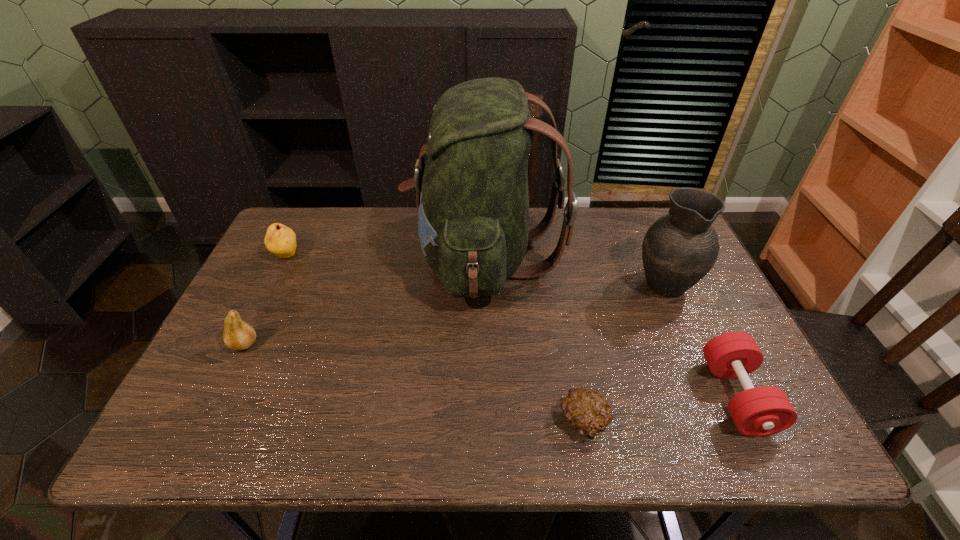
Image resolution: width=960 pixels, height=540 pixels. What are the coordinates of `pitcher present at the right edge` in the screenshot? It's located at (679, 249).

Where is `dumbbell that is at the right edge`? This screenshot has width=960, height=540. dumbbell that is at the right edge is located at coordinates (761, 411).

I want to click on object that is at the far left corner, so click(x=281, y=240).

You are a GUI agent. You are given a task and a screenshot of the screen. Output one action in this format:
    pyautogui.click(x=<x>, y=<y>)
    Task: Click on the object positioned at the near right corner
    The width and height of the screenshot is (960, 540).
    Given the screenshot: What is the action you would take?
    pyautogui.click(x=761, y=411)

In the image, there is a desktop. At what (x,y) coordinates should I click in order to perform the action: click on vacant space at the far edge. Please return your answer as a coordinate pair (x, y). The width and height of the screenshot is (960, 540). Looking at the image, I should click on (359, 239).

The height and width of the screenshot is (540, 960). I want to click on free space at the near edge of the desktop, so click(364, 449).

The image size is (960, 540). I want to click on free space at the left edge, so click(313, 258).

I want to click on free space at the right edge of the desktop, so click(x=694, y=308).

Where is `free region at the near right corner of the desktop`? This screenshot has width=960, height=540. free region at the near right corner of the desktop is located at coordinates (759, 445).

The width and height of the screenshot is (960, 540). What are the coordinates of `free point between the third nearest object and the tallest object` in the screenshot? It's located at (365, 301).